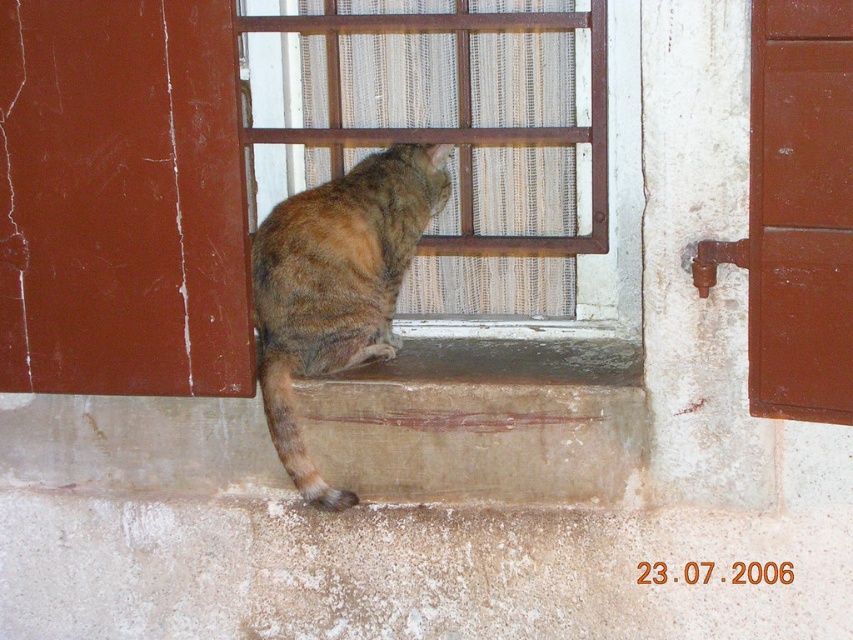
Question: Does brown woven fabric at center appear on the right side of tabby fur cat at lower center?

Choices:
 (A) no
 (B) yes

Answer: (B)

Question: Which point is closer to the camera taking this photo?

Choices:
 (A) (346, 58)
 (B) (285, 392)

Answer: (B)

Question: In this image, where is brown woven fabric at center located relative to tabby fur cat at lower center?

Choices:
 (A) above
 (B) below

Answer: (A)

Question: Is brown woven fabric at center above tabby fur cat at lower center?

Choices:
 (A) no
 (B) yes

Answer: (B)

Question: Which object appears farthest from the camera in this image?

Choices:
 (A) tabby fur cat at lower center
 (B) brown woven fabric at center

Answer: (B)